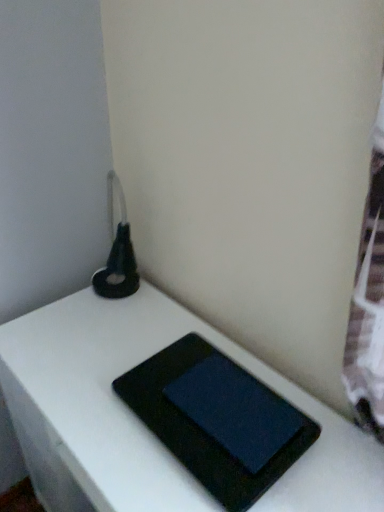
This screenshot has width=384, height=512. I want to click on free location above matte black tablet at center, acting as the 2th tablet computer starting from the bottom (from a real-world perspective), so click(233, 403).